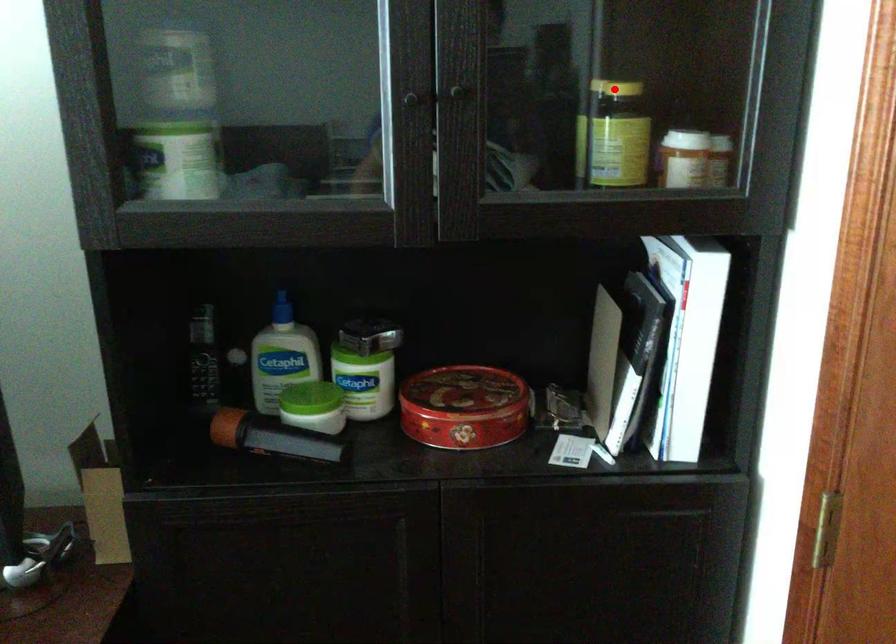
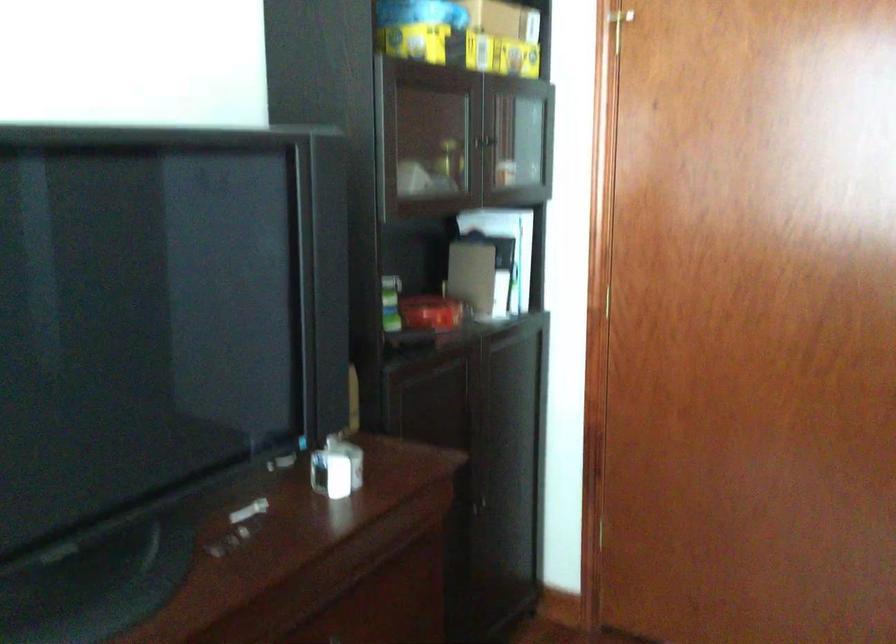
Question: I am providing you with two images of the same scene from different viewpoints. A red point is marked on the first image. At the location where the point appears in image 1, is it still visible in image 2?

Choices:
 (A) Yes
 (B) No

Answer: (B)